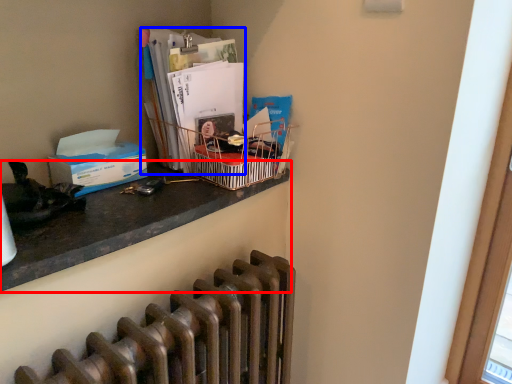
Question: Which point is closer to the camera, desk (highlighted by a red box) or magazine (highlighted by a blue box)?

Choices:
 (A) desk
 (B) magazine

Answer: (A)